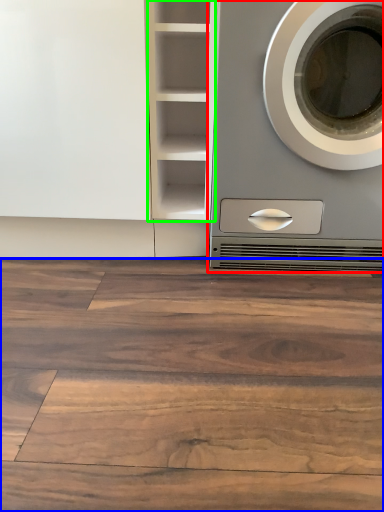
Question: Which object is the farthest from washing machine (highlighted by a red box)? Choose among these: hardwood (highlighted by a blue box) or cabinet (highlighted by a green box).

Choices:
 (A) hardwood
 (B) cabinet

Answer: (A)